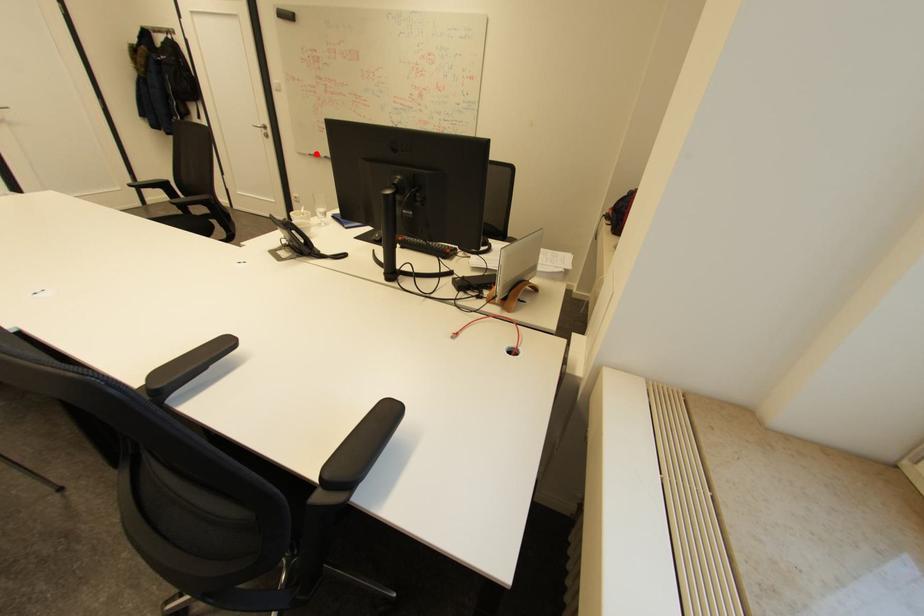
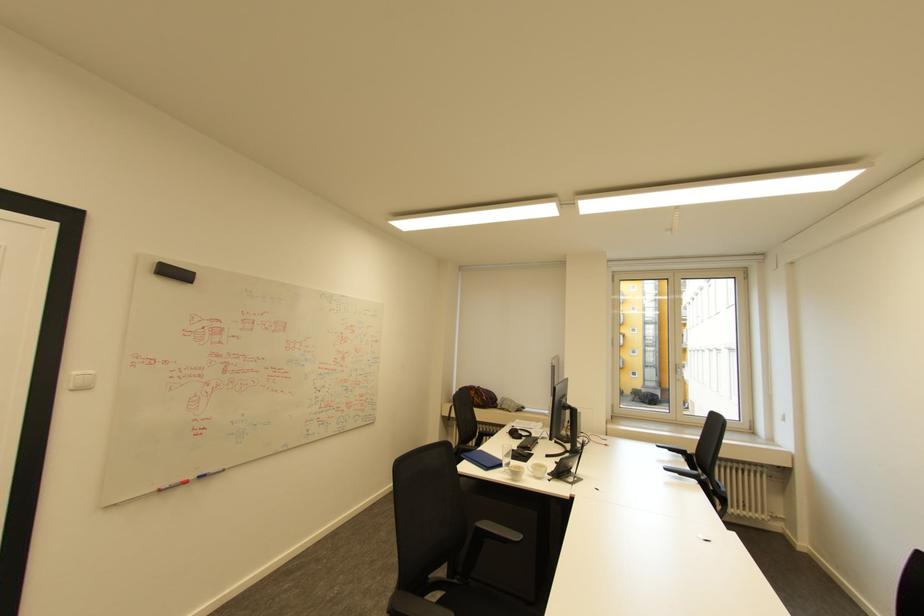
Locate, in the second image, the point that corresponds to the highlighted location in the first image.

(165, 490)